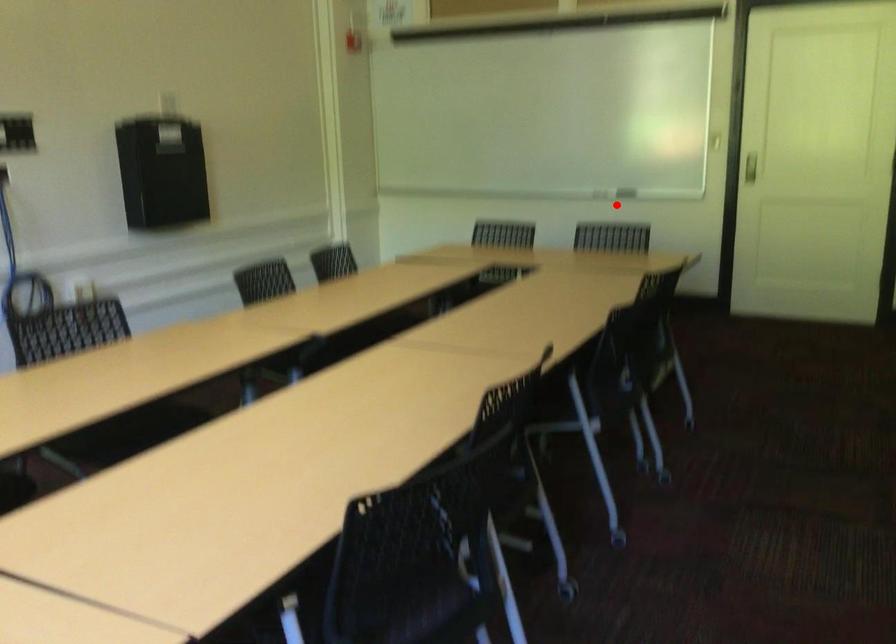
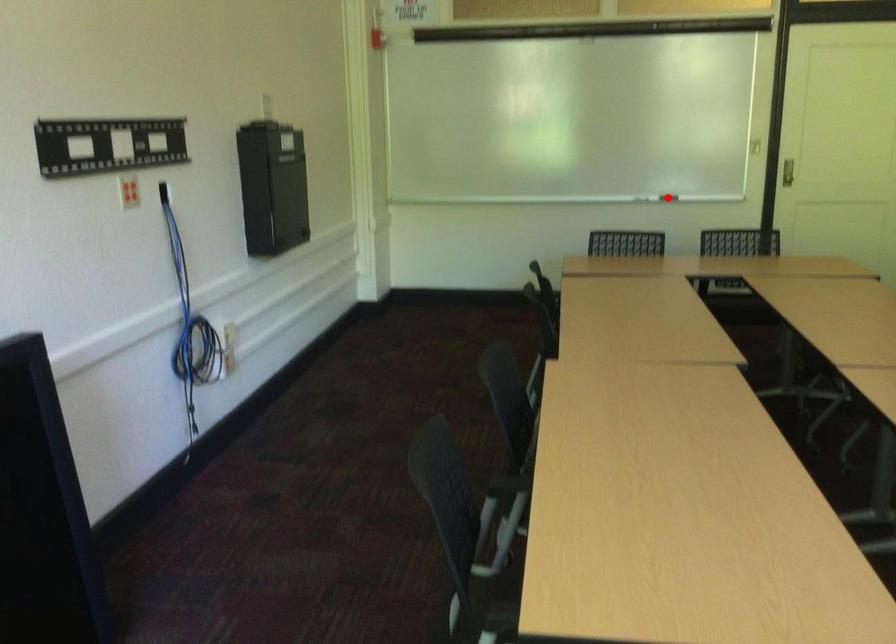
I am providing you with two images of the same scene from different viewpoints. A red point is marked on the first image and another point is marked on the second image. Does the point marked in image1 correspond to the same location as the one in image2?

Yes